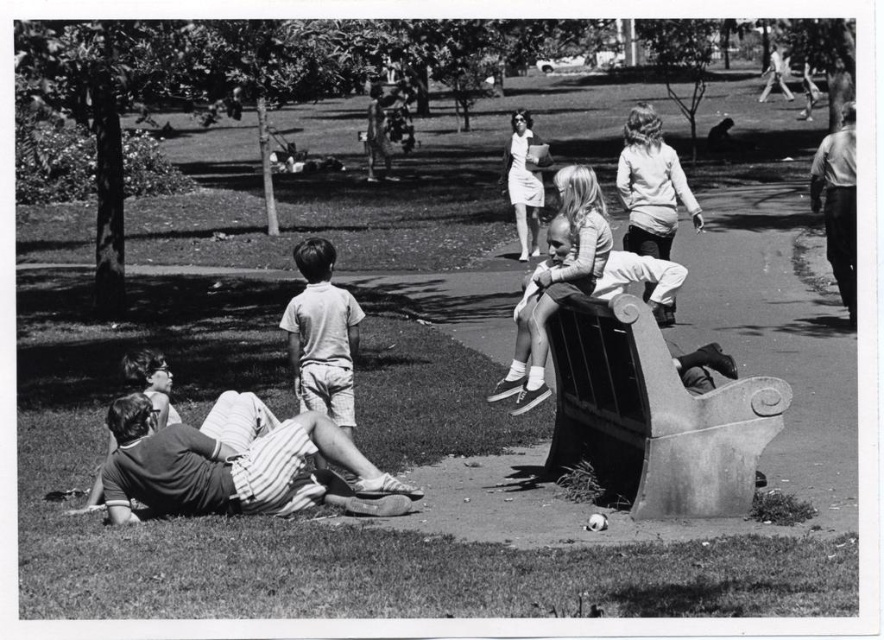
Question: Does striped cotton shorts at lower left have a greater width compared to light gray cotton shorts at center?

Choices:
 (A) no
 (B) yes

Answer: (B)

Question: Is striped cotton shorts at lower left thinner than light gray cotton shorts at center?

Choices:
 (A) yes
 (B) no

Answer: (B)

Question: Is smooth stone bench at center right wider than striped cotton shorts at lower left?

Choices:
 (A) no
 (B) yes

Answer: (A)

Question: Which point appears closest to the camera in this image?

Choices:
 (A) (707, 461)
 (B) (151, 410)

Answer: (A)

Question: Which is nearer to the striped cotton shorts at lower left?

Choices:
 (A) smooth stone bench at center right
 (B) light gray cotton shorts at center

Answer: (B)

Question: Which point is farther from the camera taking this photo?

Choices:
 (A) (134, 445)
 (B) (334, 410)

Answer: (B)